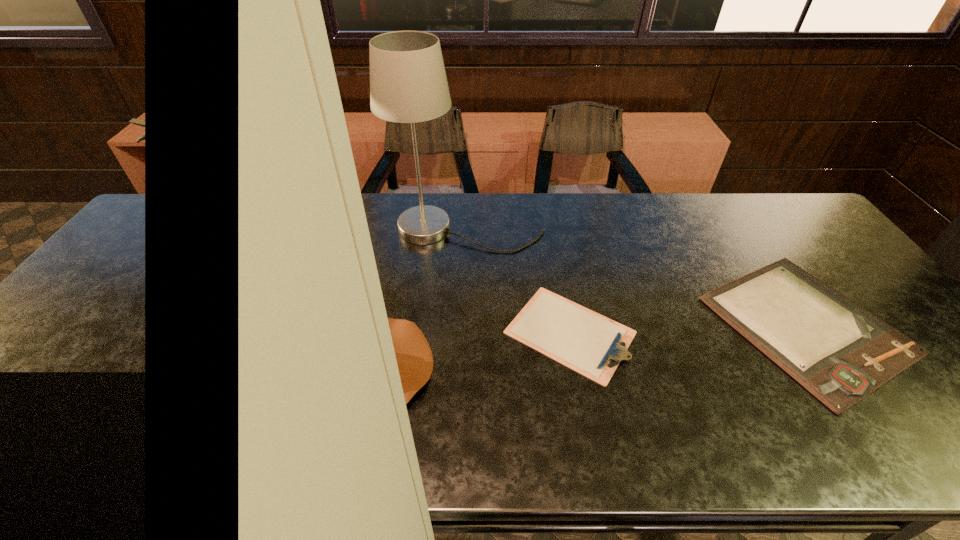
Identify the location of the tallest object. This screenshot has height=540, width=960. (408, 84).

Find the location of `the farthest object`. the farthest object is located at coordinates (408, 84).

The width and height of the screenshot is (960, 540). Find the location of `the third shortest object`. the third shortest object is located at coordinates (414, 357).

Where is `the shortest object`? This screenshot has width=960, height=540. the shortest object is located at coordinates (589, 343).

Find the location of a particular element. the shorter clipboard is located at coordinates (589, 343).

Locate an element on the screen. vacant region located 0.220m on the front of the tallest object is located at coordinates (466, 307).

Locate an element on the screen. Image resolution: width=960 pixels, height=540 pixels. vacant space located 0.060m on the right of the cowboy hat is located at coordinates (458, 370).

Identify the location of vacant space situated 0.360m on the left of the left clipboard. This screenshot has width=960, height=540. (362, 333).

The height and width of the screenshot is (540, 960). What are the coordinates of `object at the far edge` in the screenshot? It's located at (408, 84).

You are a GUI agent. You are given a task and a screenshot of the screen. Output one action in this format:
    pyautogui.click(x=<x>, y=<y>)
    Task: Click on the object situated at the near edge
    This screenshot has width=960, height=540.
    Given the screenshot: What is the action you would take?
    pyautogui.click(x=414, y=357)